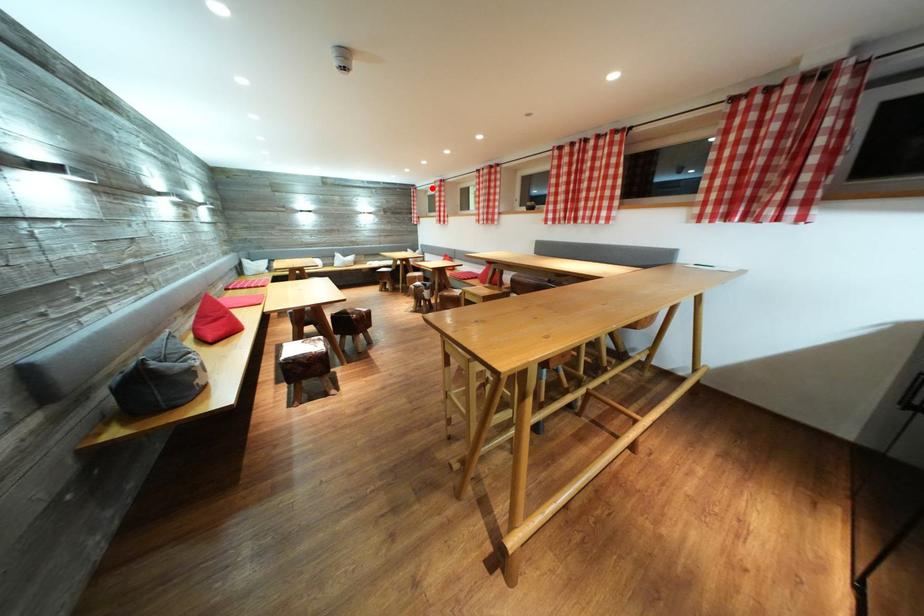
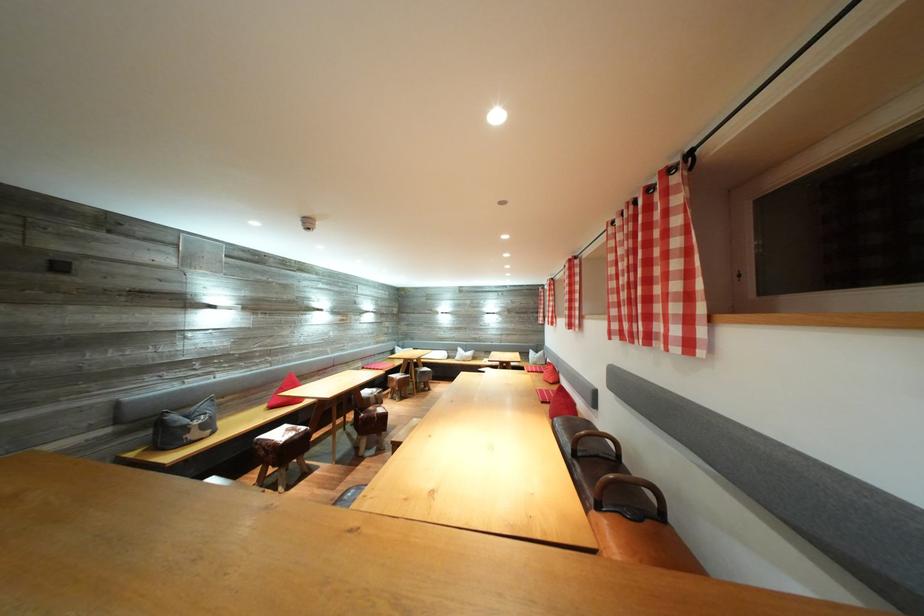
Question: I am providing you with two images of the same scene from different viewpoints. A red point is marked on the first image. Can you still see the location of the red point in image 2?

Choices:
 (A) Yes
 (B) No

Answer: (A)